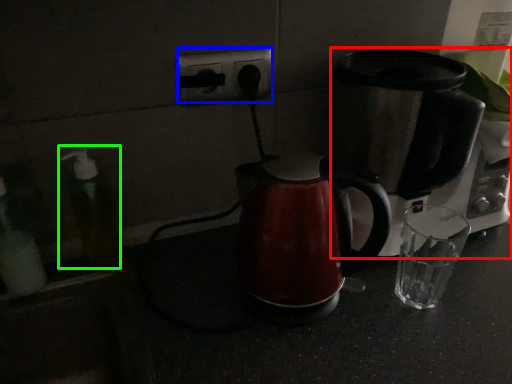
Question: Which is farther away from coffee maker (highlighted by a red box)? electric outlet (highlighted by a blue box) or soap dispenser (highlighted by a green box)?

Choices:
 (A) electric outlet
 (B) soap dispenser

Answer: (B)